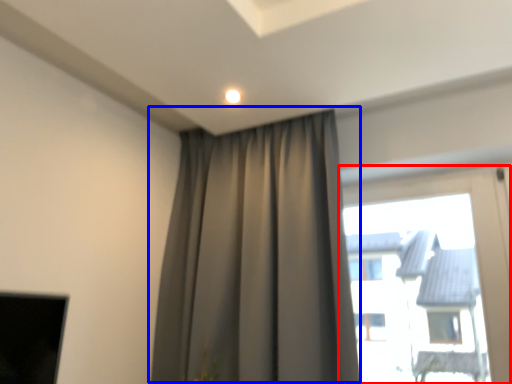
Question: Which object appears farthest to the camera in this image, window (highlighted by a red box) or curtain (highlighted by a blue box)?

Choices:
 (A) window
 (B) curtain

Answer: (A)